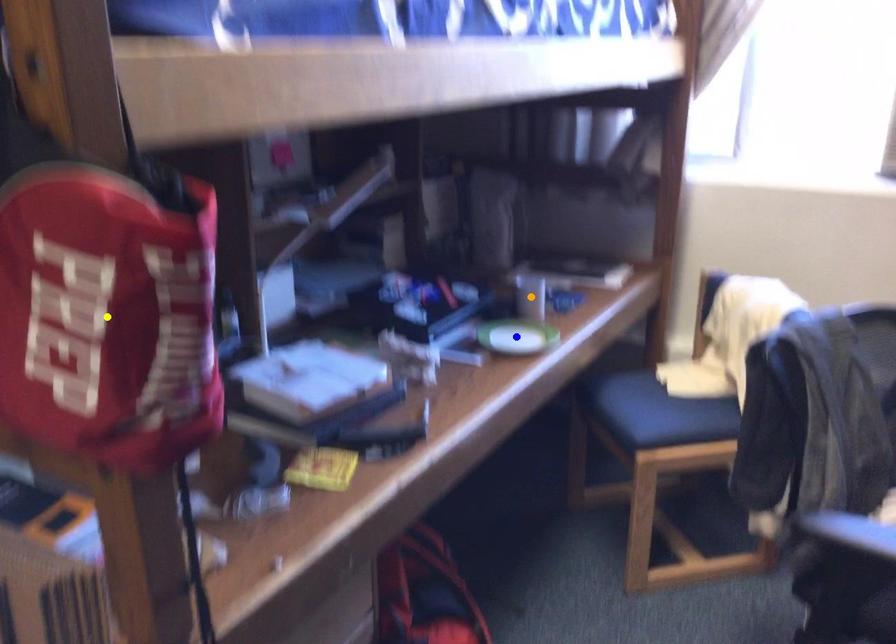
Order these from nearest to farthest:
yellow point
blue point
orange point

yellow point
blue point
orange point